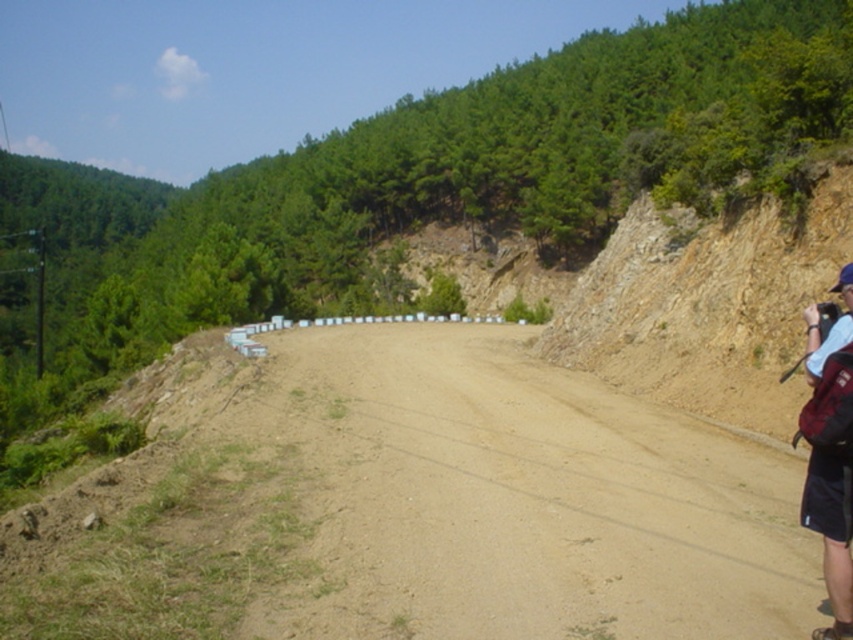
From the picture: Is brown sandy dirt track at center positioned at the back of dark blue backpack at right?

Yes, brown sandy dirt track at center is further from the viewer.

Is point (711, 435) positioned after point (838, 492)?

Yes, point (711, 435) is behind point (838, 492).

Locate an element on the screen. Image resolution: width=853 pixels, height=640 pixels. brown sandy dirt track at center is located at coordinates (546, 493).